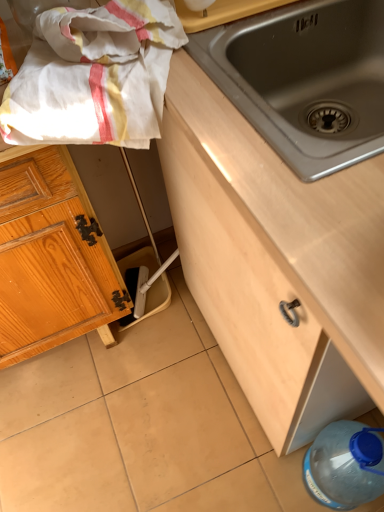
Question: Is stainless steel sink at center wider or thinner than blue translucent bottle at lower right?

Choices:
 (A) thin
 (B) wide

Answer: (B)

Question: From a real-world perspective, is stainless steel sink at center positioned above or below blue translucent bottle at lower right?

Choices:
 (A) below
 (B) above

Answer: (B)

Question: Estimate the real-world distances between objects in this image. Which object is farther from the wooden cabinet at center, which is counted as the 2th cabinetry, starting from the left?

Choices:
 (A) wooden cabinet at left, the 1th cabinetry in the left-to-right sequence
 (B) blue translucent bottle at lower right
 (C) stainless steel sink at center
 (D) white cotton towel at upper left

Answer: (A)

Question: Estimate the real-world distances between objects in this image. Which object is farther from the wooden cabinet at left, the second cabinetry from the right?

Choices:
 (A) wooden cabinet at center, which is counted as the first cabinetry, starting from the right
 (B) white cotton towel at upper left
 (C) stainless steel sink at center
 (D) blue translucent bottle at lower right

Answer: (D)